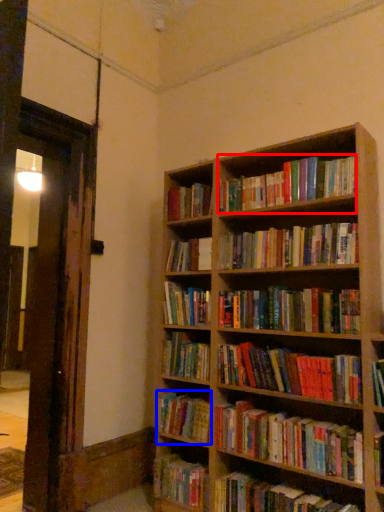
Question: Which object is closer to the camera taking this photo, book (highlighted by a red box) or book (highlighted by a blue box)?

Choices:
 (A) book
 (B) book

Answer: (A)